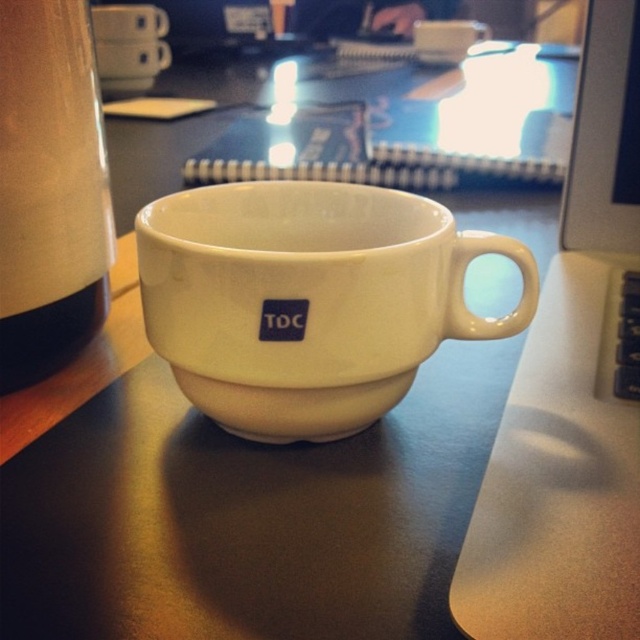
Question: Is white glossy laptop at right closer to camera compared to white matte mug at upper left?

Choices:
 (A) no
 (B) yes

Answer: (B)

Question: Which of the following is the closest to the observer?

Choices:
 (A) (250, 234)
 (B) (538, 502)
 (C) (145, 42)

Answer: (B)

Question: Is white glossy laptop at right in front of white matte mug at upper center?

Choices:
 (A) no
 (B) yes

Answer: (B)

Question: Which point is farther to the camera?

Choices:
 (A) (100, 52)
 (B) (380, 381)
 (C) (144, 29)
 (D) (141, 90)

Answer: (D)

Question: Does white ceramic mug at center appear under white matte mug at upper left?

Choices:
 (A) yes
 (B) no

Answer: (A)

Question: Which point is farther from the camera taking this photo?

Choices:
 (A) (166, 65)
 (B) (588, 445)
 (C) (93, 12)

Answer: (A)